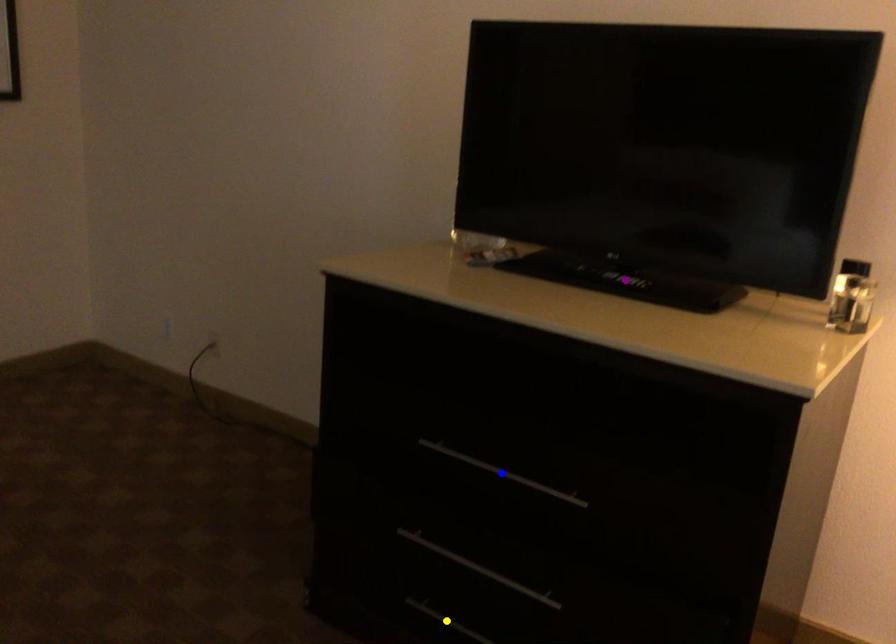
Order these from farthest to nearest:
blue point | yellow point | purple point

1. yellow point
2. purple point
3. blue point